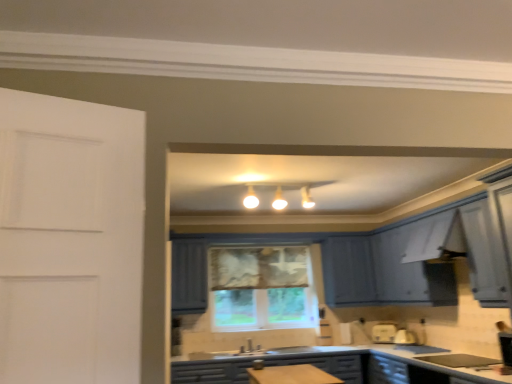
Question: Is matte blue cabinets at center wider or thinner than matte white window at center?

Choices:
 (A) wide
 (B) thin

Answer: (A)

Question: From a real-world perspective, is matte blue cabinets at center positioned above or below matte white window at center?

Choices:
 (A) below
 (B) above

Answer: (A)

Question: Looking at the image, does matte blue cabinets at center seem bigger or smaller compared to matte white window at center?

Choices:
 (A) big
 (B) small

Answer: (A)

Question: From a real-world perspective, is matte white window at center above or below matte blue cabinets at center?

Choices:
 (A) below
 (B) above

Answer: (B)

Question: From the image's perspective, relative to matte blue cabinets at center, is matte white window at center above or below?

Choices:
 (A) above
 (B) below

Answer: (A)

Question: Considering the positions of matte white window at center and matte blue cabinets at center in the image, is matte white window at center bigger or smaller than matte blue cabinets at center?

Choices:
 (A) big
 (B) small

Answer: (B)

Question: Is matte white window at center wider or thinner than matte blue cabinets at center?

Choices:
 (A) thin
 (B) wide

Answer: (A)